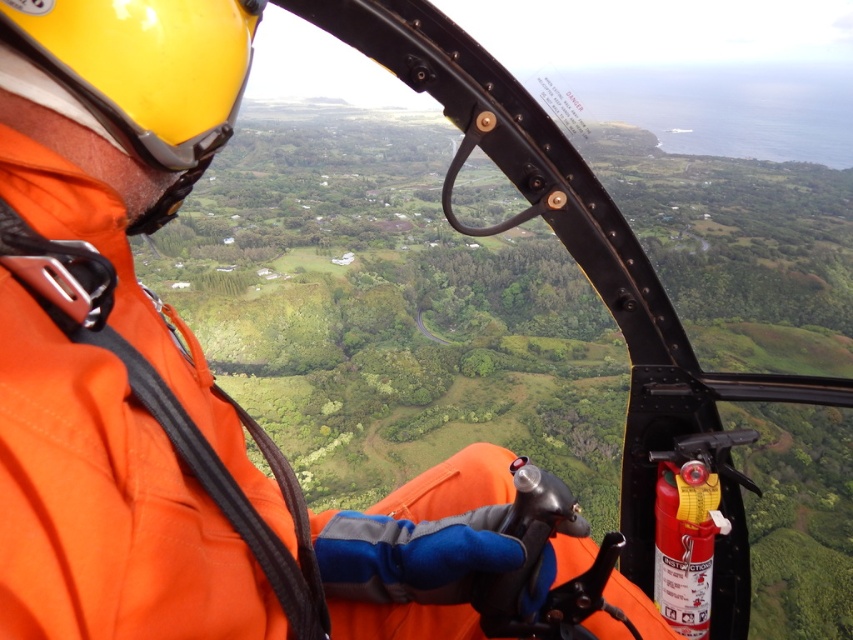
Is point (190, 564) positioned behind point (173, 109)?

No, it is not.

Does orange fabric jacket at center appear on the right side of yellow matte helmet at upper left?

Indeed, orange fabric jacket at center is positioned on the right side of yellow matte helmet at upper left.

Which is behind, point (73, 253) or point (158, 163)?

The point (158, 163) is behind.

The width and height of the screenshot is (853, 640). Identify the location of orange fabric jacket at center. (115, 330).